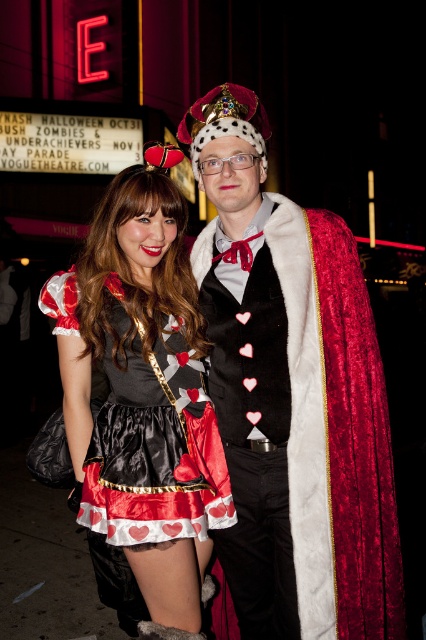
Does satin dress at center have a lesser width compared to velvet red cape at center?

No, satin dress at center is not thinner than velvet red cape at center.

Does satin dress at center appear over velvet red cape at center?

No, satin dress at center is not above velvet red cape at center.

Locate an element on the screen. The height and width of the screenshot is (640, 426). satin dress at center is located at coordinates (143, 394).

Who is taller, velvet heart-patterned dress at center or satin dress at center?

With more height is velvet heart-patterned dress at center.

Is point (275, 352) behind point (71, 454)?

That is True.

Where is `velvet heart-patterned dress at center`? Image resolution: width=426 pixels, height=640 pixels. velvet heart-patterned dress at center is located at coordinates (293, 396).

Which is below, velvet heart-patterned dress at center or velvet red cape at center?

velvet red cape at center is lower down.

Does velvet heart-patterned dress at center have a smaller size compared to velvet red cape at center?

No, velvet heart-patterned dress at center is not smaller than velvet red cape at center.

Between point (270, 586) and point (380, 490), which one is positioned in front?

Point (380, 490) is in front.

Locate an element on the screen. The height and width of the screenshot is (640, 426). velvet heart-patterned dress at center is located at coordinates (293, 396).